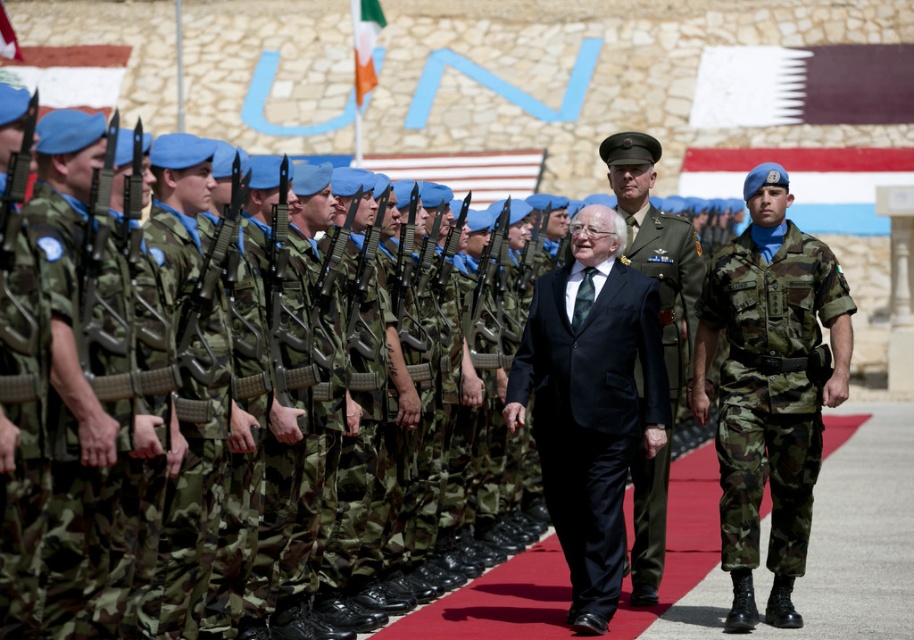
Question: Estimate the real-world distances between objects in this image. Which object is farther from the black velvet suit at center?

Choices:
 (A) camo fabric uniform at right
 (B) green uniform at center

Answer: (B)

Question: Estimate the real-world distances between objects in this image. Which object is farther from the camo fabric uniform at right?

Choices:
 (A) black velvet suit at center
 (B) green uniform at center

Answer: (A)

Question: Does black velvet suit at center have a smaller size compared to green uniform at center?

Choices:
 (A) no
 (B) yes

Answer: (B)

Question: Does camo fabric uniform at right appear on the left side of green uniform at center?

Choices:
 (A) yes
 (B) no

Answer: (B)

Question: Observing the image, what is the correct spatial positioning of black velvet suit at center in reference to green uniform at center?

Choices:
 (A) below
 (B) above

Answer: (A)

Question: Which is nearer to the green uniform at center?

Choices:
 (A) camo fabric uniform at right
 (B) black velvet suit at center

Answer: (A)